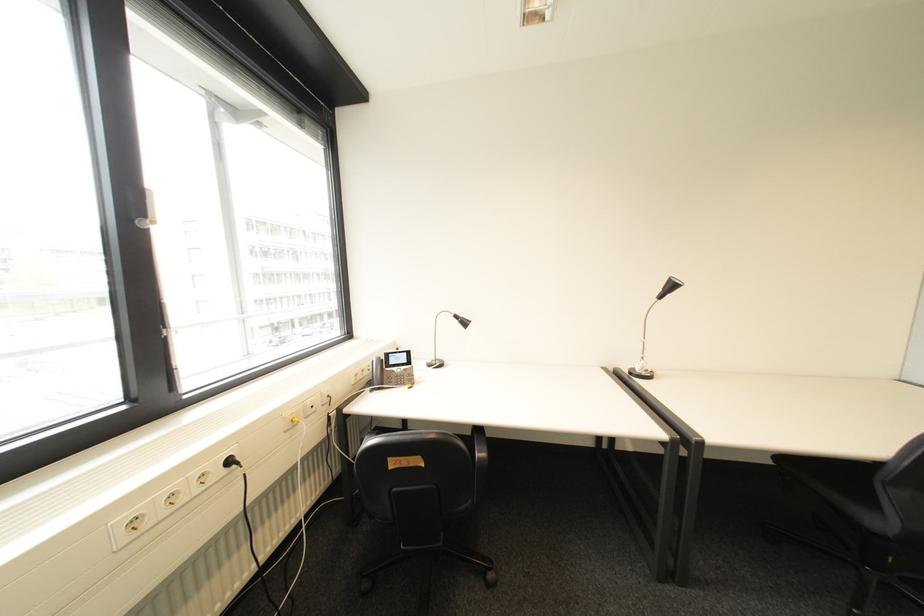
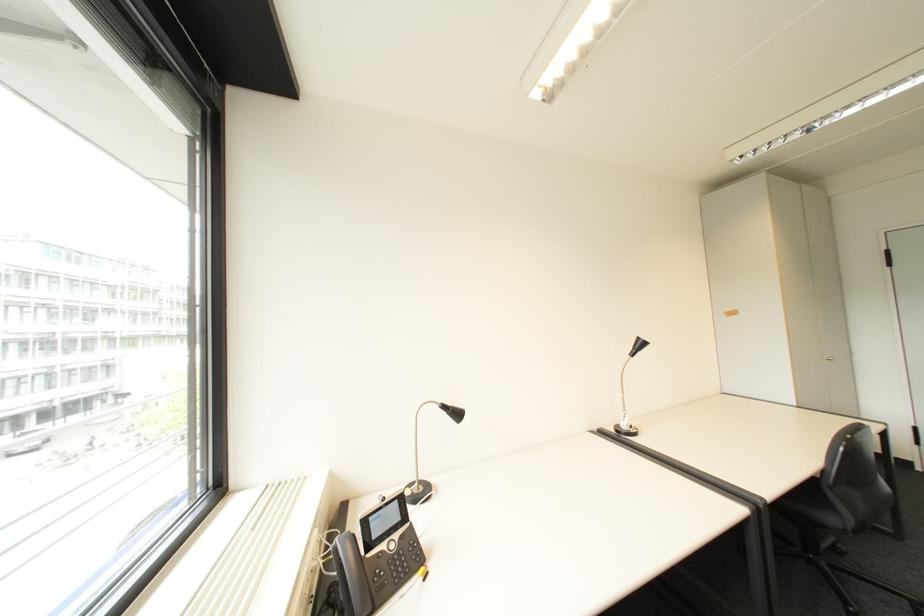
Locate, in the second image, the point that corresponds to [669,292] in the first image.

(640, 350)